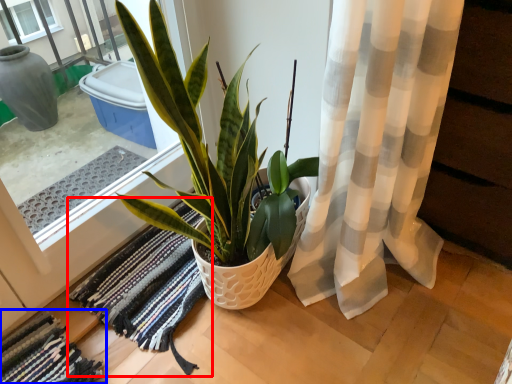
Question: Which object appears farthest to the camera in this image, bath mat (highlighted by a red box) or bath mat (highlighted by a blue box)?

Choices:
 (A) bath mat
 (B) bath mat

Answer: (A)